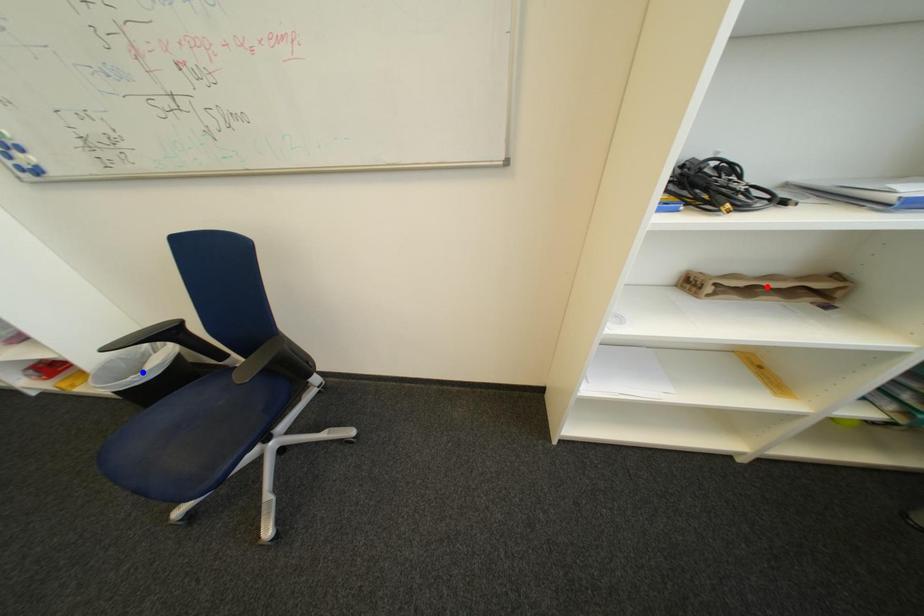
Question: Which of the two points in the image is closer to the camera?

Choices:
 (A) Blue point is closer.
 (B) Red point is closer.

Answer: (B)